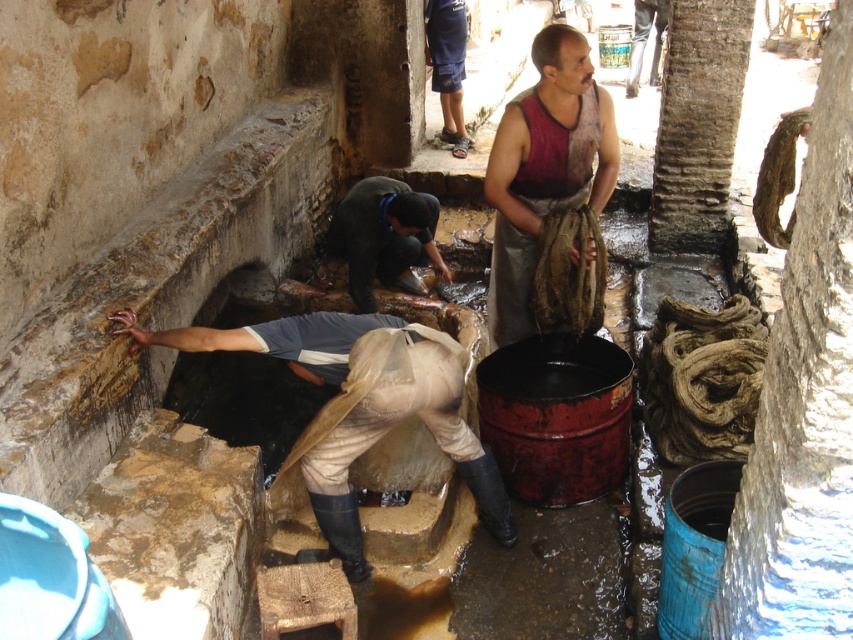
Question: Where is dark gray fabric at lower center located in relation to dark blue denim shorts at center in the image?

Choices:
 (A) right
 (B) left

Answer: (B)

Question: Among these points, which one is nearest to the camera?

Choices:
 (A) (352, 257)
 (B) (459, 3)
 (C) (547, 196)

Answer: (C)

Question: Which point appears farthest from the camera in this image?

Choices:
 (A) (506, 216)
 (B) (430, 12)

Answer: (B)

Question: In this image, where is light brown leather boots at lower center located relative to dark blue denim shorts at center?

Choices:
 (A) left
 (B) right

Answer: (A)

Question: Is light brown leather boots at lower center below dark red sleeveless shirt at center?

Choices:
 (A) yes
 (B) no

Answer: (A)

Question: Which of the following is the farthest from the observer?

Choices:
 (A) dark gray fabric at lower center
 (B) dark red sleeveless shirt at center

Answer: (A)